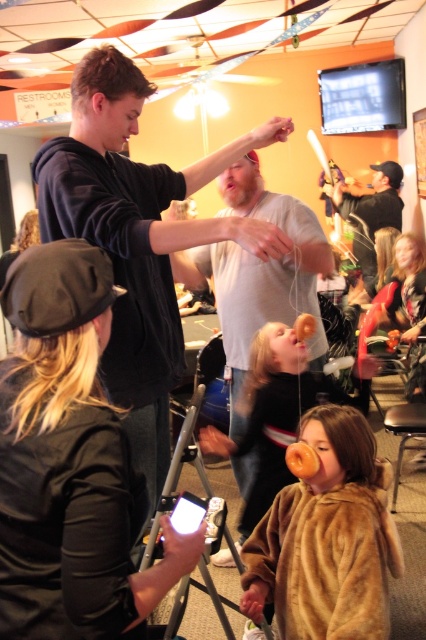
Question: Based on their relative distances, which object is farther from the black matte hoodie at upper left?

Choices:
 (A) brown furry coat at lower center
 (B) brown furry coat at center

Answer: (A)

Question: Based on their relative distances, which object is farther from the brown furry coat at lower center?

Choices:
 (A) matte black shirt at center
 (B) brown furry coat at center
 (C) black matte hoodie at upper left

Answer: (A)

Question: Which point is farther from the camera taking this photo?

Choices:
 (A) (377, 172)
 (B) (207, 433)

Answer: (A)

Question: Can you confirm if brown furry coat at center is positioned to the left of matte black shirt at center?

Choices:
 (A) no
 (B) yes

Answer: (B)

Question: Can you confirm if brown furry coat at center is bigger than matte black shirt at center?

Choices:
 (A) no
 (B) yes

Answer: (A)

Question: Can you confirm if black matte hoodie at upper left is bigger than matte black shirt at center?

Choices:
 (A) no
 (B) yes

Answer: (B)